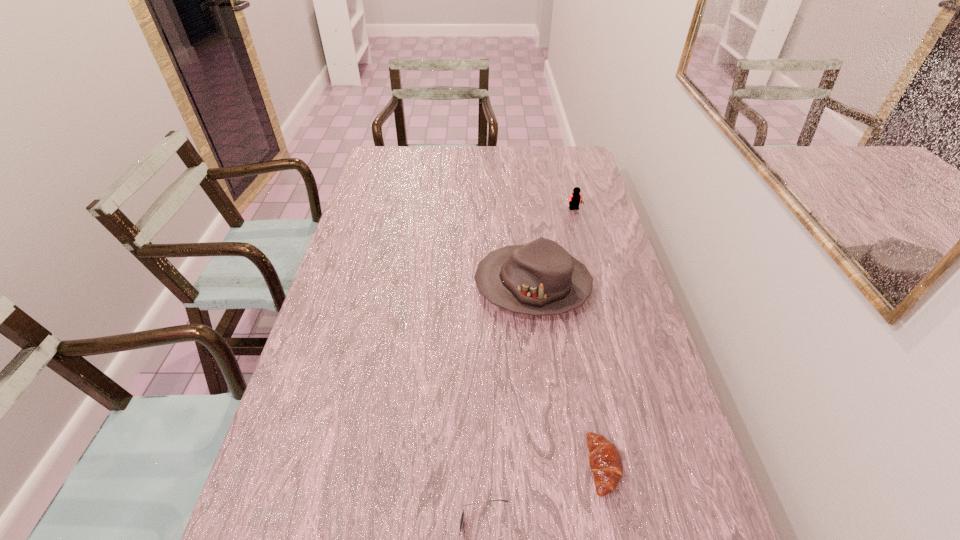
Where is `the tallest object`? the tallest object is located at coordinates (540, 278).

Locate an element on the screen. This screenshot has width=960, height=540. hat is located at coordinates (540, 278).

You are a GUI agent. You are given a task and a screenshot of the screen. Output one action in this format:
    pyautogui.click(x=<x>, y=<y>)
    Task: Click on the Lego
    The image size is (960, 540).
    Given the screenshot: What is the action you would take?
    pyautogui.click(x=575, y=198)

You are a GUI agent. You are given a task and a screenshot of the screen. Output one action in this format:
    pyautogui.click(x=<x>, y=<y>)
    Task: Click on the farthest object
    This screenshot has height=540, width=960.
    Given the screenshot: What is the action you would take?
    pyautogui.click(x=575, y=198)

Identify the location of crescent roll. The width and height of the screenshot is (960, 540). (605, 460).

You are a GUI agent. You are given a task and a screenshot of the screen. Output one action in this format:
    pyautogui.click(x=<x>, y=<y>)
    Task: Click on the second shortest object
    This screenshot has height=540, width=960.
    Given the screenshot: What is the action you would take?
    pyautogui.click(x=605, y=460)

The height and width of the screenshot is (540, 960). I want to click on free space located 0.110m on the decorative side of the hat, so [438, 285].

Find the location of a particular element. blank space located on the decorative side of the hat is located at coordinates (397, 285).

The width and height of the screenshot is (960, 540). I want to click on vacant space located 0.360m on the decorative side of the hat, so click(x=353, y=285).

Locate an element on the screen. vacant position located 0.140m on the front-facing side of the second tallest object is located at coordinates (582, 237).